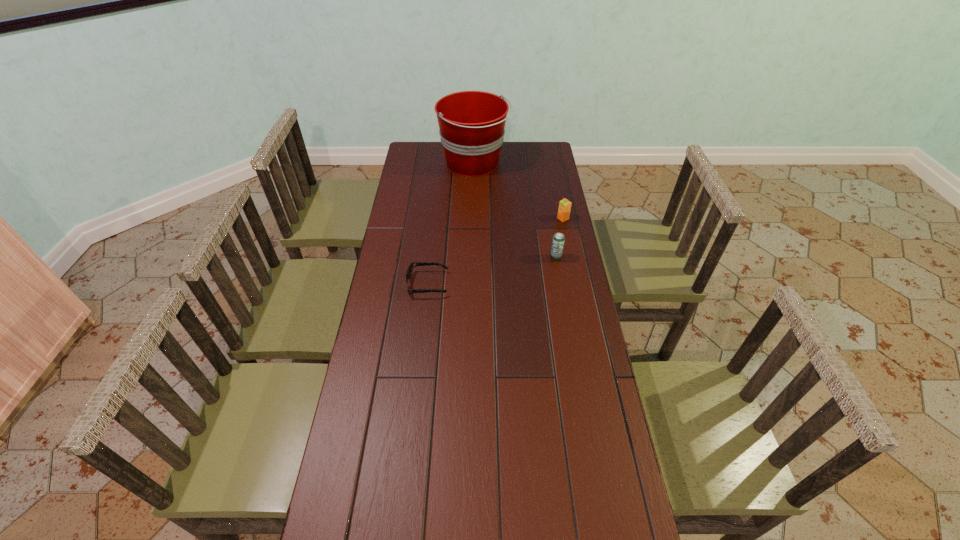
Find the location of a particular element. free point located on the left of the orange juice is located at coordinates pyautogui.click(x=519, y=219).

What are the coordinates of `vacant point located on the front-facing side of the nearest object` in the screenshot? It's located at coord(555,284).

You are a GUI agent. You are given a task and a screenshot of the screen. Output one action in this format:
    pyautogui.click(x=<x>, y=<y>)
    Task: Click on the object located at the far edge
    Image resolution: width=960 pixels, height=540 pixels.
    Given the screenshot: What is the action you would take?
    point(471,123)

At what (x,y) coordinates should I click in order to perform the action: click on object present at the left edge. Please return your answer as a coordinate pair (x, y). This screenshot has height=540, width=960. Looking at the image, I should click on pos(409,271).

The width and height of the screenshot is (960, 540). Find the location of `beer can located at the right edge`. beer can located at the right edge is located at coordinates [558, 240].

Find the location of a particular element. orange juice that is at the right edge is located at coordinates (564, 209).

In the image, there is a desktop. In order to click on vacant area at the left edge in this screenshot , I will do `click(343, 502)`.

This screenshot has height=540, width=960. I want to click on blank space at the right edge of the desktop, so click(530, 221).

The image size is (960, 540). I want to click on vacant space at the far left corner, so click(x=405, y=163).

Find the location of `vacant point located between the second object from right to left and the sunglasses`. vacant point located between the second object from right to left and the sunglasses is located at coordinates (492, 271).